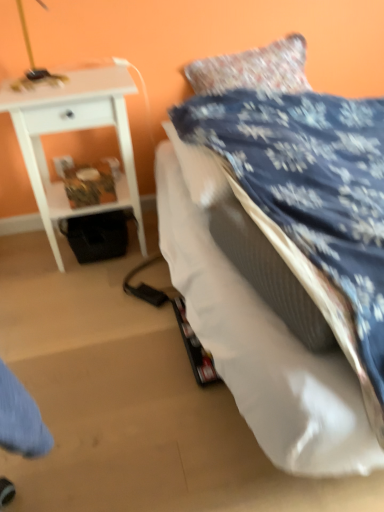
Question: Can you confirm if white glossy nightstand at upper left is bigger than blue fabric bed at upper right?

Choices:
 (A) yes
 (B) no

Answer: (B)

Question: Is white glossy nightstand at upper left aimed at blue fabric bed at upper right?

Choices:
 (A) no
 (B) yes

Answer: (A)

Question: From a real-world perspective, is white glossy nightstand at upper left physically below blue fabric bed at upper right?

Choices:
 (A) no
 (B) yes

Answer: (A)

Question: Is white glossy nightstand at upper left closer to camera compared to blue fabric bed at upper right?

Choices:
 (A) no
 (B) yes

Answer: (A)

Question: Is white glossy nightstand at upper left located outside blue fabric bed at upper right?

Choices:
 (A) yes
 (B) no

Answer: (A)

Question: Does white glossy nightstand at upper left have a lesser width compared to blue fabric bed at upper right?

Choices:
 (A) no
 (B) yes

Answer: (B)

Question: From a real-world perspective, is blue fabric bed at upper right positioned under white glossy nightstand at upper left based on gravity?

Choices:
 (A) no
 (B) yes

Answer: (B)

Question: Is white glossy nightstand at upper left at the back of blue fabric bed at upper right?

Choices:
 (A) no
 (B) yes

Answer: (A)

Question: From the image's perspective, would you say blue fabric bed at upper right is positioned over white glossy nightstand at upper left?

Choices:
 (A) yes
 (B) no

Answer: (B)

Question: Could you tell me if blue fabric bed at upper right is turned towards white glossy nightstand at upper left?

Choices:
 (A) yes
 (B) no

Answer: (B)

Question: Considering the relative sizes of blue fabric bed at upper right and white glossy nightstand at upper left in the image provided, is blue fabric bed at upper right smaller than white glossy nightstand at upper left?

Choices:
 (A) yes
 (B) no

Answer: (B)

Question: From a real-world perspective, is blue fabric bed at upper right located higher than white glossy nightstand at upper left?

Choices:
 (A) no
 (B) yes

Answer: (A)

Question: Is white glossy nightstand at upper left situated inside blue fabric bed at upper right or outside?

Choices:
 (A) outside
 (B) inside

Answer: (A)